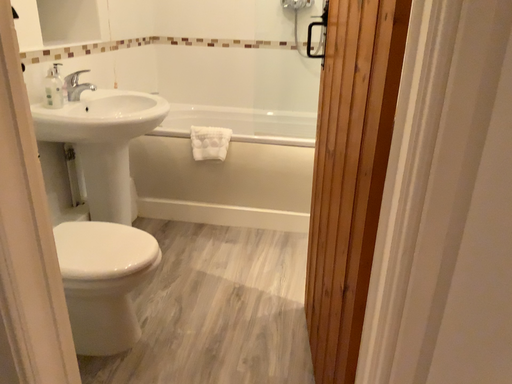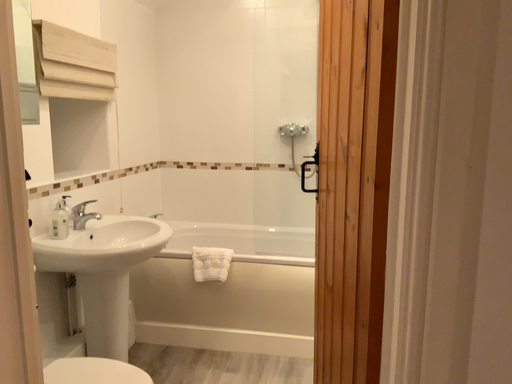
Question: How did the camera likely rotate when shooting the video?

Choices:
 (A) rotated upward
 (B) rotated downward

Answer: (A)